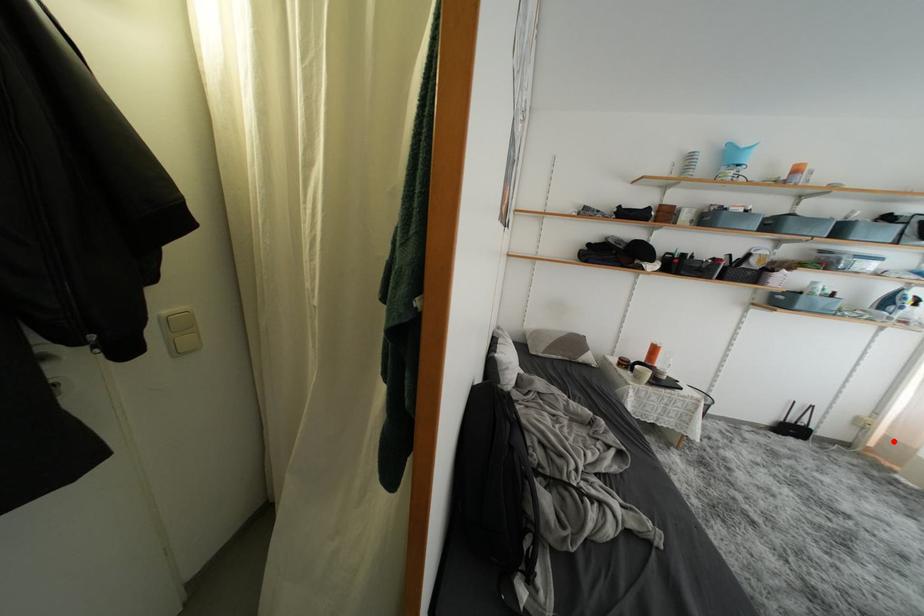
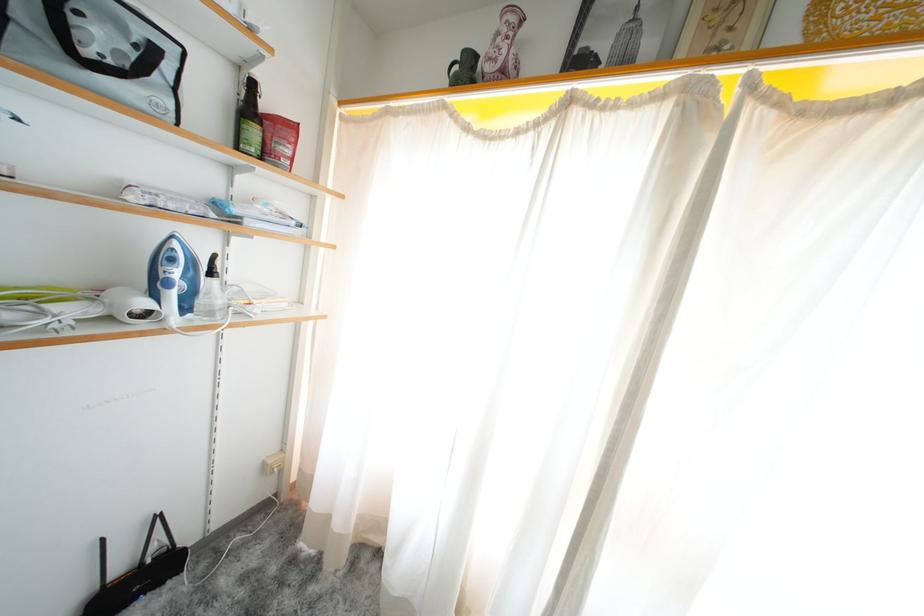
Question: I am providing you with two images of the same scene from different viewpoints. Given a red point in image1, look at the same physical point in image2. Is it:

Choices:
 (A) Closer to the viewpoint
 (B) Farther from the viewpoint

Answer: (A)